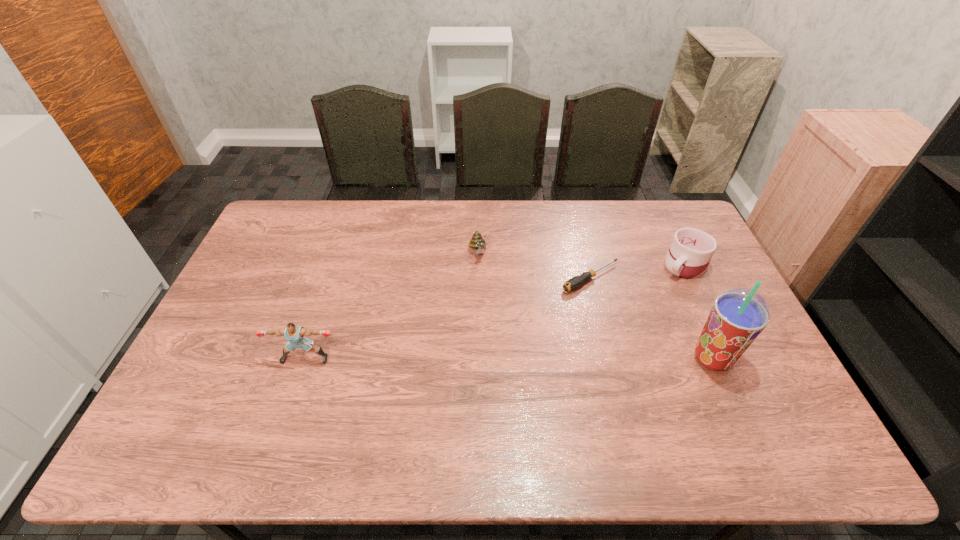
This screenshot has width=960, height=540. In order to click on vacant position at the far edge of the desktop in this screenshot , I will do `click(542, 205)`.

This screenshot has width=960, height=540. Find the location of `free space at the near edge of the desktop`. free space at the near edge of the desktop is located at coordinates (254, 403).

What are the coordinates of `free spot at the left edge of the desktop` in the screenshot? It's located at (184, 382).

Where is `vacant space at the far left corner of the desktop`? The width and height of the screenshot is (960, 540). vacant space at the far left corner of the desktop is located at coordinates (282, 220).

Locate an element on the screen. free space at the near right corner of the desktop is located at coordinates (761, 404).

What are the coordinates of `vacant area that lies between the snail and the shortest object` in the screenshot? It's located at (535, 266).

This screenshot has width=960, height=540. In order to click on free space between the third object from left to right and the smoothie in this screenshot , I will do (x=651, y=318).

You are a GUI agent. You are given a task and a screenshot of the screen. Output one action in this format:
    pyautogui.click(x=<x>, y=<y>)
    Task: Click on the vacant region between the mug and the fourth object from right to left
    The height and width of the screenshot is (540, 960).
    Given the screenshot: What is the action you would take?
    pyautogui.click(x=582, y=259)

The width and height of the screenshot is (960, 540). In order to click on free space between the smoothie and the screwdriver in this screenshot , I will do `click(651, 318)`.

At what (x,y) coordinates should I click in order to perform the action: click on free space between the mug and the leftmost object. Please return your answer as a coordinate pair (x, y). This screenshot has width=960, height=540. Looking at the image, I should click on (495, 312).